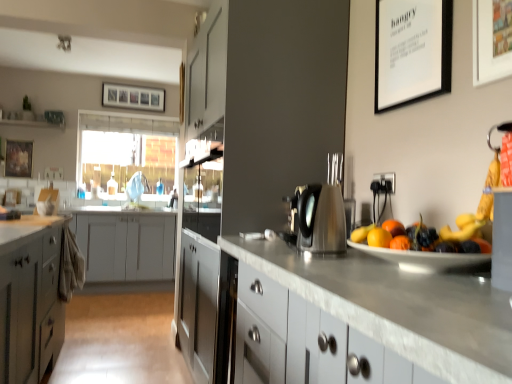
Question: Considering the relative sizes of wooden picture frame at upper center, arranged as the 1th picture frame when viewed from the back, and metallic silver fruit dish at right in the image provided, is wooden picture frame at upper center, arranged as the 1th picture frame when viewed from the back, smaller than metallic silver fruit dish at right?

Choices:
 (A) no
 (B) yes

Answer: (B)

Question: Is wooden picture frame at upper center, the second picture frame from the left, not within metallic silver fruit dish at right?

Choices:
 (A) no
 (B) yes

Answer: (B)

Question: Is wooden picture frame at upper center, arranged as the 1th picture frame when viewed from the back, wider than metallic silver fruit dish at right?

Choices:
 (A) no
 (B) yes

Answer: (A)

Question: Is wooden picture frame at upper center, acting as the third picture frame starting from the right, shorter than metallic silver fruit dish at right?

Choices:
 (A) yes
 (B) no

Answer: (B)

Question: Considering the relative positions of wooden picture frame at upper center, the 4th picture frame when ordered from front to back, and metallic silver fruit dish at right in the image provided, is wooden picture frame at upper center, the 4th picture frame when ordered from front to back, to the left of metallic silver fruit dish at right from the viewer's perspective?

Choices:
 (A) no
 (B) yes

Answer: (B)

Question: Does wooden picture frame at upper center, arranged as the 1th picture frame when viewed from the back, appear on the right side of metallic silver fruit dish at right?

Choices:
 (A) yes
 (B) no

Answer: (B)

Question: Does satin silver kettle at center come in front of wooden picture frame at upper center, acting as the third picture frame starting from the right?

Choices:
 (A) yes
 (B) no

Answer: (A)

Question: Is satin silver kettle at center far away from wooden picture frame at upper center, acting as the third picture frame starting from the right?

Choices:
 (A) yes
 (B) no

Answer: (A)

Question: Is satin silver kettle at center to the right of wooden picture frame at upper center, arranged as the 1th picture frame when viewed from the back, from the viewer's perspective?

Choices:
 (A) no
 (B) yes

Answer: (B)

Question: Is the position of satin silver kettle at center more distant than that of wooden picture frame at upper center, the second picture frame from the left?

Choices:
 (A) yes
 (B) no

Answer: (B)

Question: Can you confirm if satin silver kettle at center is wider than wooden picture frame at upper center, arranged as the 1th picture frame when viewed from the back?

Choices:
 (A) yes
 (B) no

Answer: (A)

Question: Is satin silver kettle at center to the left of wooden picture frame at upper center, the 4th picture frame when ordered from front to back, from the viewer's perspective?

Choices:
 (A) yes
 (B) no

Answer: (B)

Question: Considering the relative sizes of white matte picture frame at upper right, arranged as the third picture frame when viewed from the left, and satin gray cabinet at center in the image provided, is white matte picture frame at upper right, arranged as the third picture frame when viewed from the left, taller than satin gray cabinet at center?

Choices:
 (A) yes
 (B) no

Answer: (B)